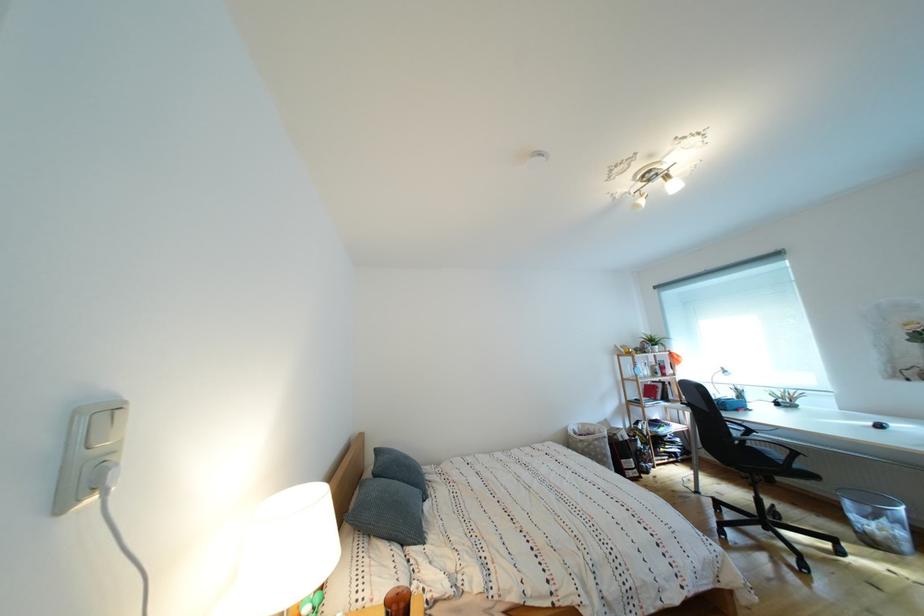
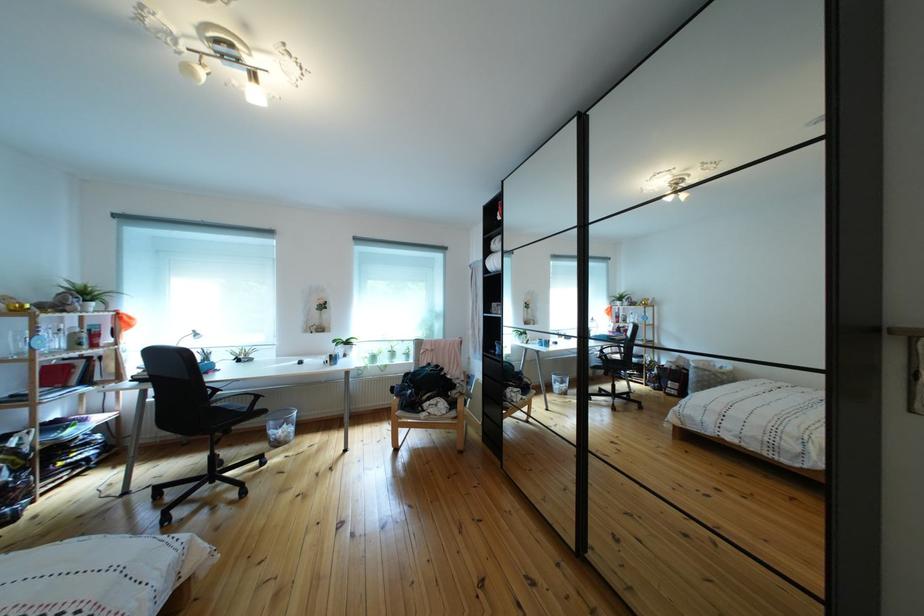
Where in the second image is the point corresponding to pixel 761 437 from the first image?

(227, 395)